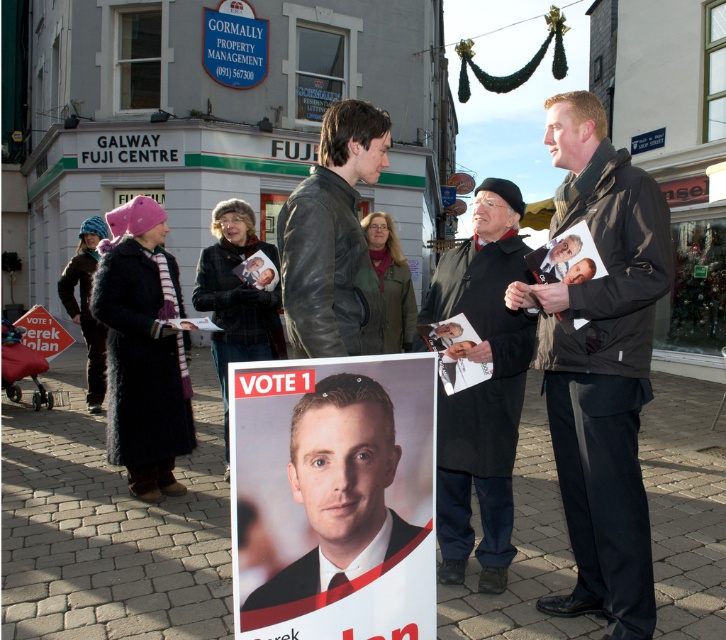
Question: Among these objects, which one is farthest from the camera?

Choices:
 (A) white paper poster at center
 (B) blue knitted hat at left

Answer: (B)

Question: Can you confirm if black wool coat at center is positioned to the right of white paper sign at lower left?

Choices:
 (A) yes
 (B) no

Answer: (A)

Question: Can you confirm if dark brown leather jacket at center is thinner than blue knitted hat at left?

Choices:
 (A) yes
 (B) no

Answer: (A)

Question: Which point is closer to the camera?

Choices:
 (A) (330, 115)
 (B) (485, 458)

Answer: (A)

Question: Among these points, which one is nearest to the camera?

Choices:
 (A) (83, 320)
 (B) (492, 182)
 (C) (428, 326)
 (D) (311, 483)

Answer: (D)

Question: Does dark brown leather jacket at center have a lesser width compared to leather jacket at center?

Choices:
 (A) yes
 (B) no

Answer: (B)